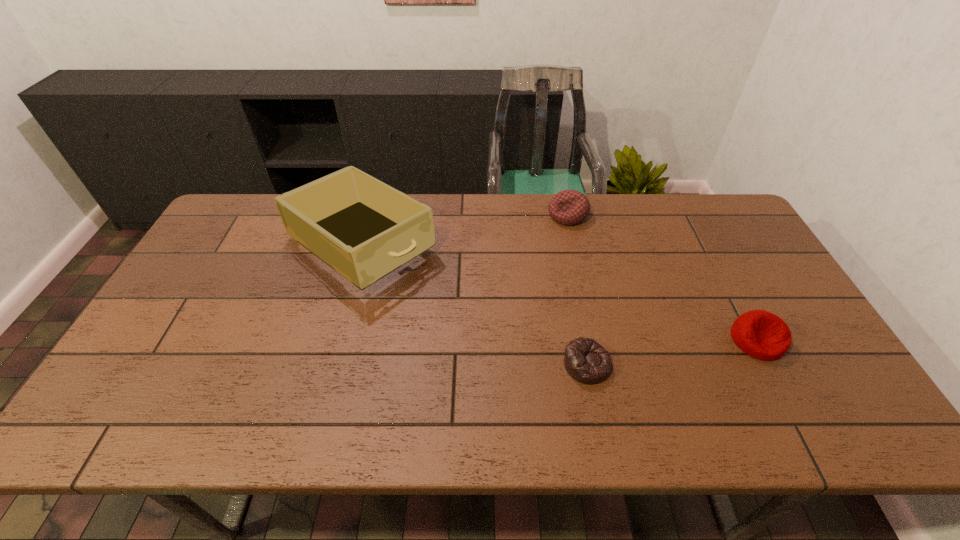
Where is `beanbag located at the far edge`? The width and height of the screenshot is (960, 540). beanbag located at the far edge is located at coordinates (569, 207).

Identify the location of object located at the right edge. Image resolution: width=960 pixels, height=540 pixels. (760, 334).

I want to click on free space at the far edge of the desktop, so click(492, 237).

I want to click on vacant space at the near edge, so click(769, 409).

In the image, there is a desktop. Where is `free space at the left edge`? Image resolution: width=960 pixels, height=540 pixels. free space at the left edge is located at coordinates (233, 282).

Identify the location of free point at the right edge. This screenshot has height=540, width=960. coord(769,288).

In the image, there is a desktop. Identify the location of blank space at the near left corner. (93, 428).

This screenshot has height=540, width=960. What are the coordinates of `free location at the near right corner` in the screenshot? It's located at (821, 406).

Where is `free spot between the rightmost beanbag and the shortest object`? Image resolution: width=960 pixels, height=540 pixels. free spot between the rightmost beanbag and the shortest object is located at coordinates (672, 353).

Locate an element on the screen. vacant area between the farthest beanbag and the rightmost object is located at coordinates (662, 278).